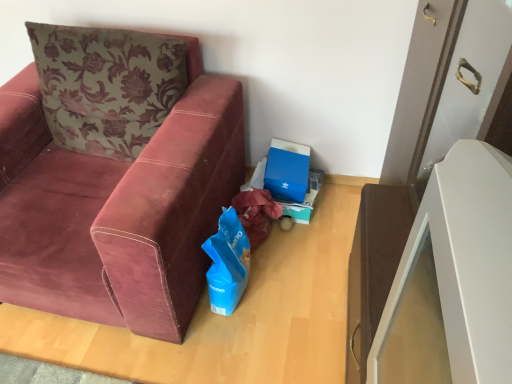
Question: Is blue matte gift bag at lower center located outside velvet maroon couch at left?

Choices:
 (A) yes
 (B) no

Answer: (A)

Question: From the image's perspective, is blue matte gift bag at lower center located beneath velvet maroon couch at left?

Choices:
 (A) yes
 (B) no

Answer: (A)

Question: Considering the relative sizes of blue matte gift bag at lower center and velvet maroon couch at left in the image provided, is blue matte gift bag at lower center thinner than velvet maroon couch at left?

Choices:
 (A) no
 (B) yes

Answer: (B)

Question: Is velvet maroon couch at left surrounded by blue matte gift bag at lower center?

Choices:
 (A) no
 (B) yes

Answer: (A)

Question: Are blue matte gift bag at lower center and velvet maroon couch at left far apart?

Choices:
 (A) yes
 (B) no

Answer: (B)

Question: Is blue matte gift bag at lower center aimed at velvet maroon couch at left?

Choices:
 (A) no
 (B) yes

Answer: (A)

Question: From a real-world perspective, is blue matte gift bag at lower center located higher than blue cardboard box at center?

Choices:
 (A) yes
 (B) no

Answer: (A)

Question: From the image's perspective, is blue matte gift bag at lower center under blue cardboard box at center?

Choices:
 (A) no
 (B) yes

Answer: (B)

Question: Is blue matte gift bag at lower center smaller than blue cardboard box at center?

Choices:
 (A) no
 (B) yes

Answer: (A)

Question: Does blue matte gift bag at lower center have a greater width compared to blue cardboard box at center?

Choices:
 (A) no
 (B) yes

Answer: (B)

Question: Is the surface of blue matte gift bag at lower center in direct contact with blue cardboard box at center?

Choices:
 (A) yes
 (B) no

Answer: (B)

Question: Is blue matte gift bag at lower center aimed at blue cardboard box at center?

Choices:
 (A) yes
 (B) no

Answer: (B)

Question: Can you confirm if blue cardboard box at center is bigger than velvet maroon couch at left?

Choices:
 (A) no
 (B) yes

Answer: (A)